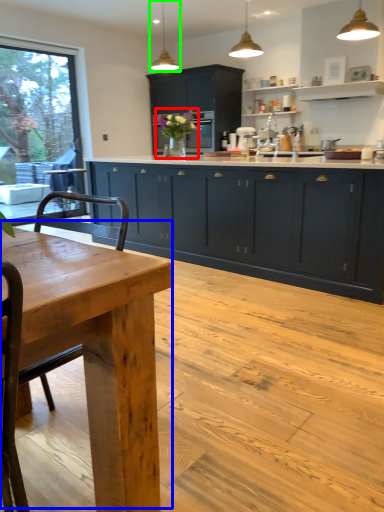
Question: Which object is the farthest from floral arrangement (highlighted by a red box)? Choose among these: kitchen & dining room table (highlighted by a blue box) or light fixture (highlighted by a green box).

Choices:
 (A) kitchen & dining room table
 (B) light fixture

Answer: (A)